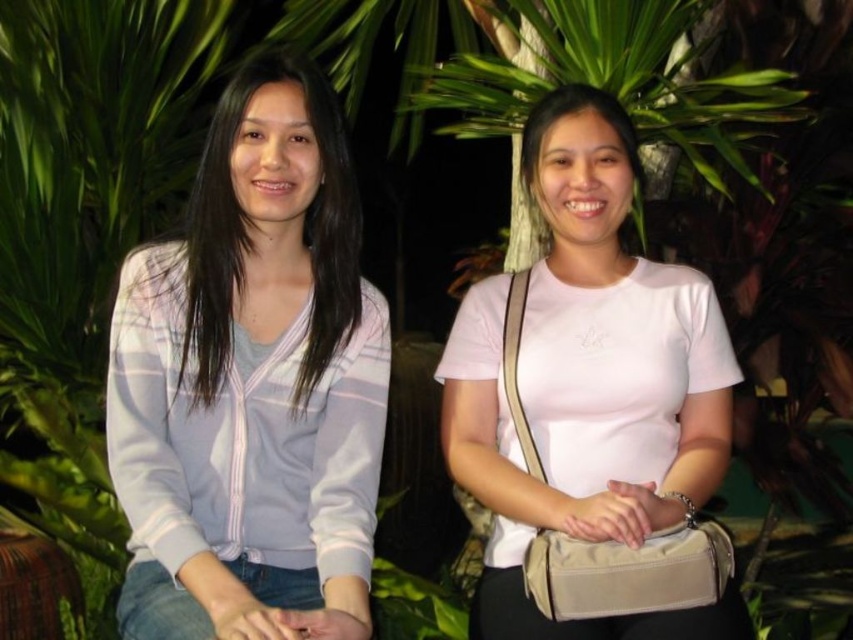
You are a photographer adjusting your camera settings to focus on the light purple striped cardigan at left and the pink matte shirt at center. Which object should you focus on first to ensure both are in sharp focus?

The light purple striped cardigan at left is closer to the viewer than the pink matte shirt at center. To ensure both are in sharp focus, you should focus on the light purple striped cardigan at left first, as it is closer, and adjust the depth of field accordingly.